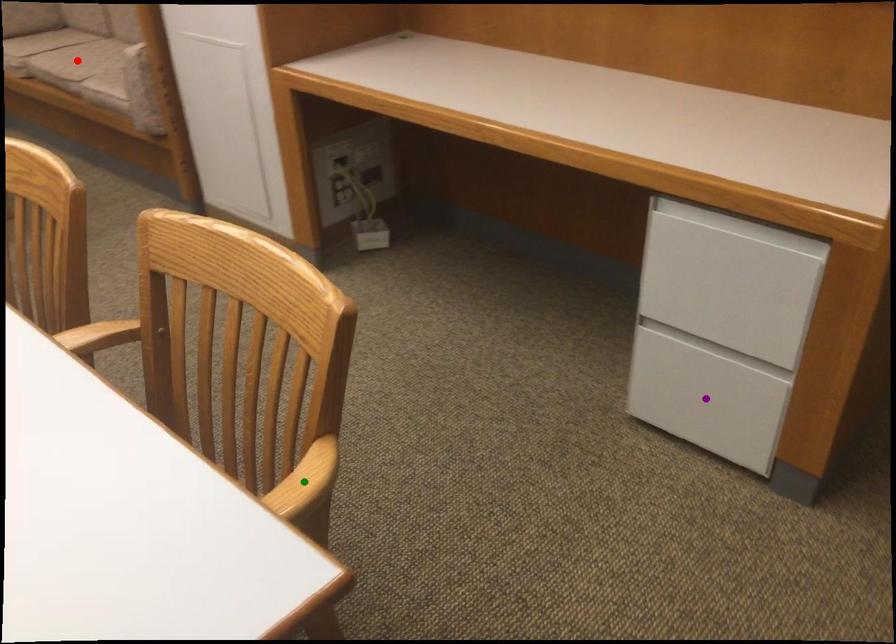
Order these from nearest to farthest:
A) red point
B) green point
C) purple point

red point < purple point < green point